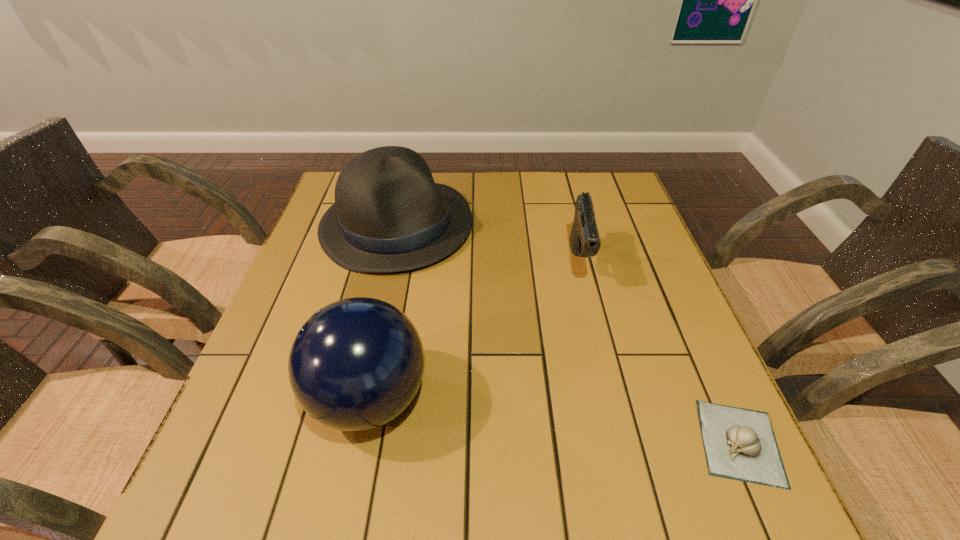
You are a GUI agent. You are given a task and a screenshot of the screen. Output one action in this format:
    pyautogui.click(x=<x>, y=<y>)
    Task: Click on the bowling ball
    This screenshot has width=960, height=540.
    Given the screenshot: What is the action you would take?
    pyautogui.click(x=356, y=364)

Identify the location of the rightmost object. The image size is (960, 540). (740, 444).

Find the location of a particular element. This screenshot has height=540, width=960. the shortest object is located at coordinates (740, 444).

The width and height of the screenshot is (960, 540). Find the location of `bowler hat`. bowler hat is located at coordinates (389, 215).

The width and height of the screenshot is (960, 540). I want to click on the third object from left to right, so click(584, 240).

Identify the location of the second shortest object. (584, 240).

You are a GUI agent. You are given a task and a screenshot of the screen. Output one action in this format:
    pyautogui.click(x=<x>, y=<y>)
    Task: Click on the free region located on the surface of the bowling ball near the finger holes
    The image size is (960, 540).
    Given the screenshot: What is the action you would take?
    pyautogui.click(x=240, y=399)

The width and height of the screenshot is (960, 540). In order to click on free space located 0.100m on the surface of the bowling ball near the finger holes in this screenshot , I will do `click(256, 399)`.

Locate an element on the screen. The image size is (960, 540). free space located on the back of the shortest object is located at coordinates (680, 309).

At what (x,y) coordinates should I click in order to perform the action: click on free location located 0.320m on the front-facing side of the bowler hat. Please return your answer as a coordinate pair (x, y). The image size is (960, 540). Looking at the image, I should click on (523, 349).